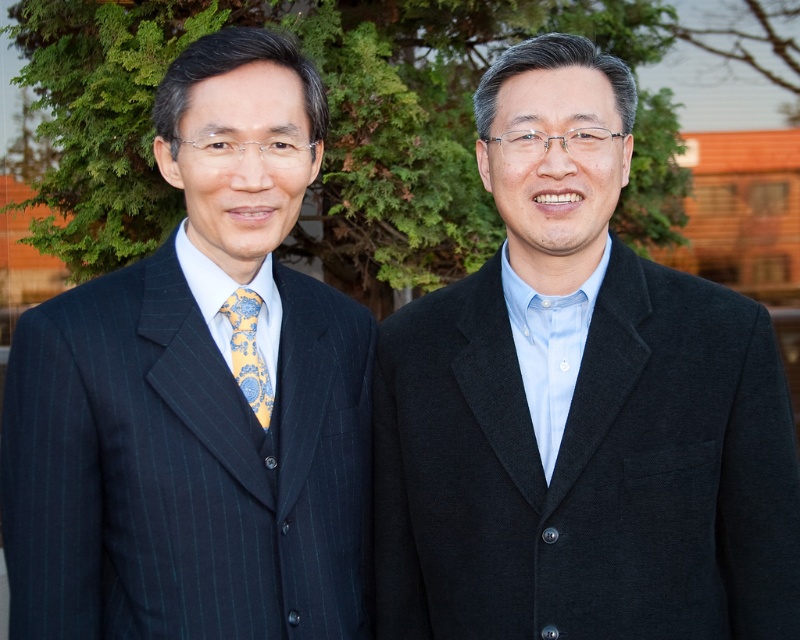
You are a photographer setting up for an outdoor event. You notice two guests wearing the pinstriped suit at left and the dark gray woolen suit at right. The background has a wooden structure behind green foliage. To ensure both guests are fully visible, which guest should you position closer to the camera?

The pinstriped suit at left should be positioned closer to the camera because it is positioned over the dark gray woolen suit at right, meaning it is already in front and would remain visible when aligned properly.

You are taking a photo of the two people in the scene. You want to focus on the person closer to the camera. Which point, point [197,280] or point [468,276], should you aim the camera at?

Point [197,280] is closer to the viewer, so you should aim the camera at point [197,280] to focus on the person closer to the camera.

You are standing at the origin point in a coordinate system where the bottom left corner of the image is the origin. The pinstriped suit at left is located at coordinates approximately where? Please provide the coordinates as a tuple of two decimal numbers.

The pinstriped suit at left is located at coordinates approximately at point [197,396].